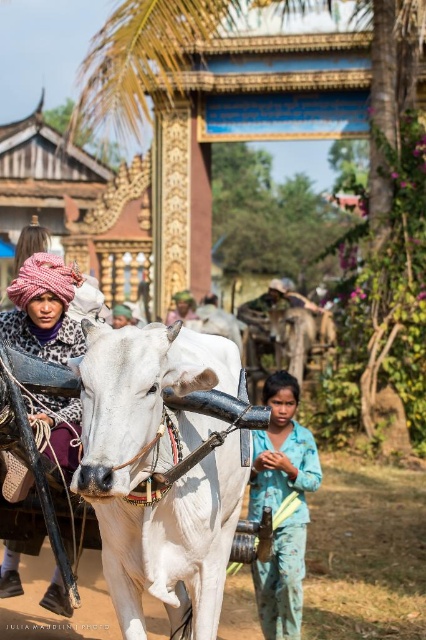
Does blue cotton shirt at center appear under knitted pink turban at left?

Yes, blue cotton shirt at center is below knitted pink turban at left.

Between blue cotton shirt at center and knitted pink turban at left, which one has less height?

Standing shorter between the two is blue cotton shirt at center.

Which is behind, point (261, 573) or point (57, 593)?

The point (261, 573) is more distant.

You are a GUI agent. You are given a task and a screenshot of the screen. Output one action in this format:
    pyautogui.click(x=<x>, y=<y>)
    Task: Click on the blue cotton shirt at center
    Image resolution: width=426 pixels, height=640 pixels.
    Given the screenshot: What is the action you would take?
    pyautogui.click(x=279, y=504)